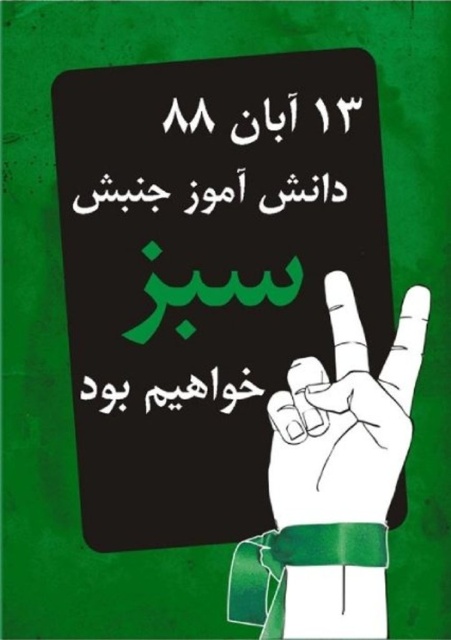
Question: Which of the following is the farthest from the observer?

Choices:
 (A) (284, 515)
 (B) (225, 412)

Answer: (B)

Question: Observing the image, what is the correct spatial positioning of white paper hand at center in reference to black paper at center?

Choices:
 (A) right
 (B) left

Answer: (A)

Question: Which object is closer to the camera taking this photo?

Choices:
 (A) black paper at center
 (B) white paper hand at center

Answer: (B)

Question: Which point is farther to the camera?

Choices:
 (A) (162, 406)
 (B) (353, 435)

Answer: (A)

Question: Does white paper hand at center have a greater width compared to black paper at center?

Choices:
 (A) no
 (B) yes

Answer: (A)

Question: Does white paper hand at center appear over black paper at center?

Choices:
 (A) no
 (B) yes

Answer: (B)